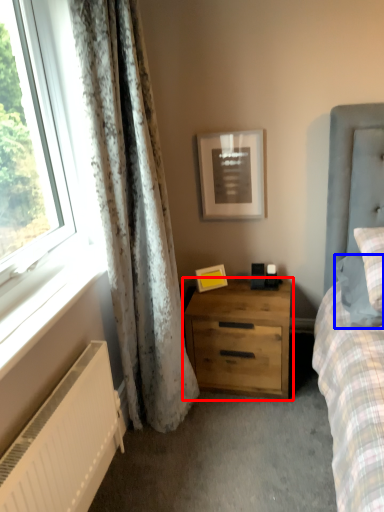
Question: Which of the following is the closest to the observer, nightstand (highlighted by a red box) or pillow (highlighted by a blue box)?

Choices:
 (A) nightstand
 (B) pillow

Answer: (B)